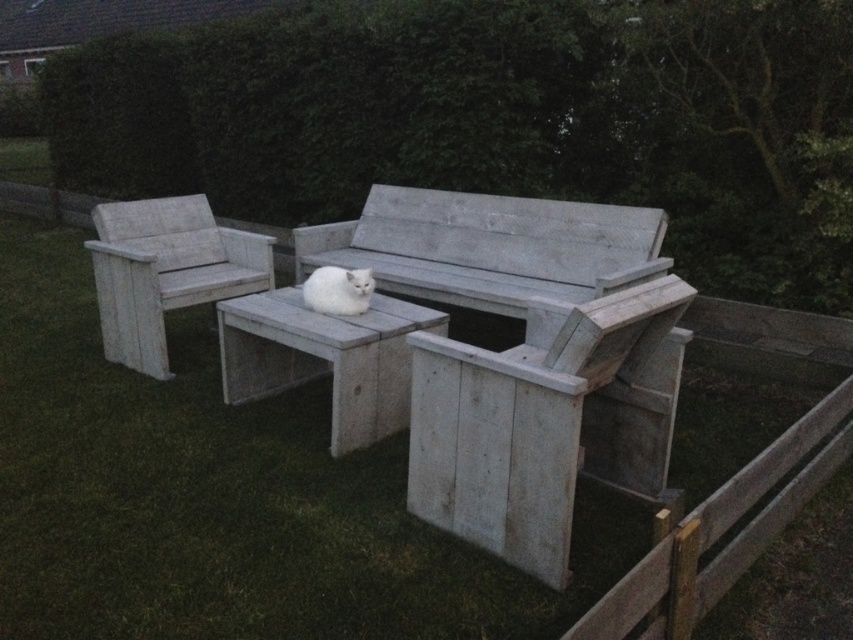
Who is lower down, gray wooden bench at center or white wood bench at left?

Positioned lower is white wood bench at left.

Which is behind, point (550, 563) or point (177, 284)?

Positioned behind is point (177, 284).

Measure the distance between point [618,376] and camera.

Point [618,376] and camera are 9.58 feet apart from each other.

Where is `gray wooden bench at center`? Image resolution: width=853 pixels, height=640 pixels. gray wooden bench at center is located at coordinates 523,355.

Can you confirm if green leafy hedge at upper center is bigger than gray wooden bench at center?

No, green leafy hedge at upper center is not bigger than gray wooden bench at center.

Who is positioned more to the right, green leafy hedge at upper center or gray wooden bench at center?

From the viewer's perspective, green leafy hedge at upper center appears more on the right side.

The image size is (853, 640). Find the location of `green leafy hedge at upper center`. green leafy hedge at upper center is located at coordinates (496, 120).

In the scene shown: Between wooden bench at center and white wood bench at left, which one appears on the left side from the viewer's perspective?

Positioned to the left is white wood bench at left.

Does wooden bench at center have a larger size compared to white wood bench at left?

Incorrect, wooden bench at center is not larger than white wood bench at left.

Is point (408, 304) farther from viewer compared to point (149, 330)?

That is False.

Locate an element on the screen. wooden bench at center is located at coordinates (323, 356).